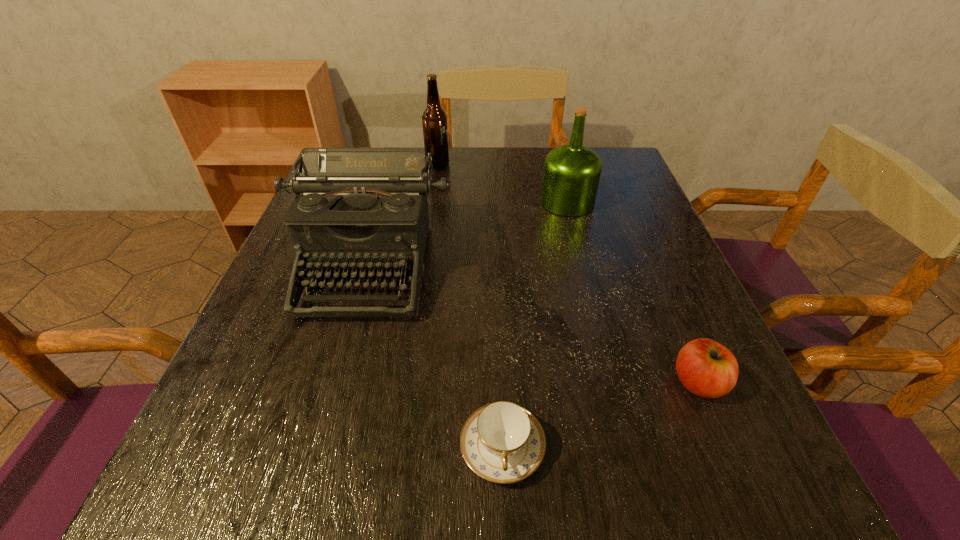
The image size is (960, 540). I want to click on free space at the far edge of the desktop, so click(522, 183).

Identify the location of vacant region at the near edge. The image size is (960, 540). (592, 495).

The image size is (960, 540). Find the location of `vacant space at the left edge`. vacant space at the left edge is located at coordinates (288, 375).

Locate an element on the screen. Image resolution: width=960 pixels, height=540 pixels. vacant space at the right edge of the desktop is located at coordinates (700, 421).

The image size is (960, 540). In the image, there is a desktop. In order to click on vacant space at the far right corner in this screenshot , I will do `click(615, 155)`.

Locate an element on the screen. This screenshot has width=960, height=540. vacant region between the second shortest object and the farthest object is located at coordinates (568, 274).

Find the location of a particular element. The height and width of the screenshot is (540, 960). vacant point located between the third object from right to left and the third farthest object is located at coordinates (436, 356).

I want to click on unoccupied area between the shortest object and the second shortest object, so click(x=600, y=415).

The height and width of the screenshot is (540, 960). Find the location of `free spot between the third farthest object and the rightmost object`. free spot between the third farthest object and the rightmost object is located at coordinates (534, 324).

Find the location of a particular element. The width and height of the screenshot is (960, 540). blank region between the typewriter and the olive oil is located at coordinates (468, 234).